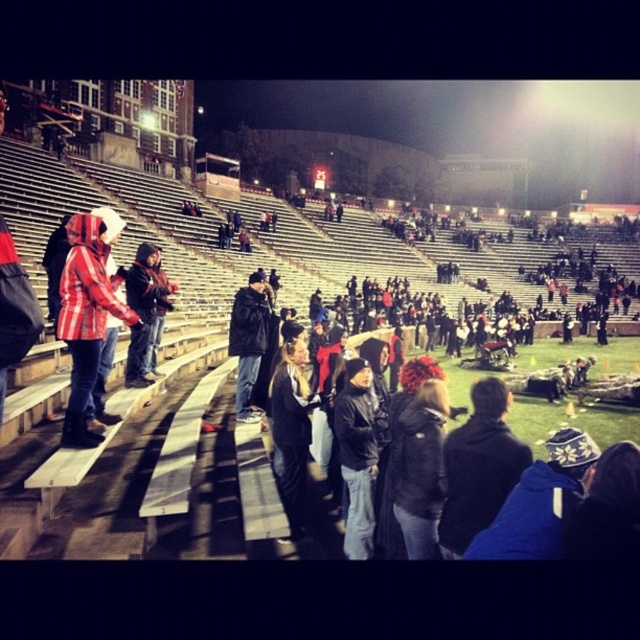
You are a photographer trying to capture a photo of both the dark gray hoodie at center and the dark red hoodie at center. Since you want to ensure both are fully visible, which hoodie should you focus on first to avoid cropping the taller one out?

The dark gray hoodie at center is not as tall as the dark red hoodie at center, so you should focus on the dark red hoodie at center first to ensure it fits within the frame before adjusting for the shorter one.

You are a spectator at the game and want to find the dark gray hoodie at center. Which direction should you look relative to the dark red hoodie at center?

The dark gray hoodie at center is located below the dark red hoodie at center, so you should look downward from the dark red hoodie at center to find it.